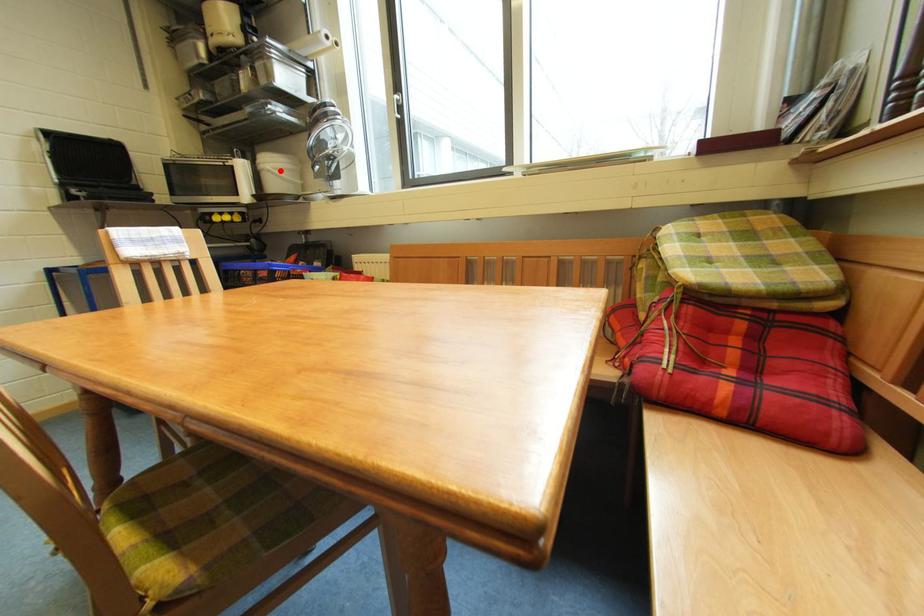
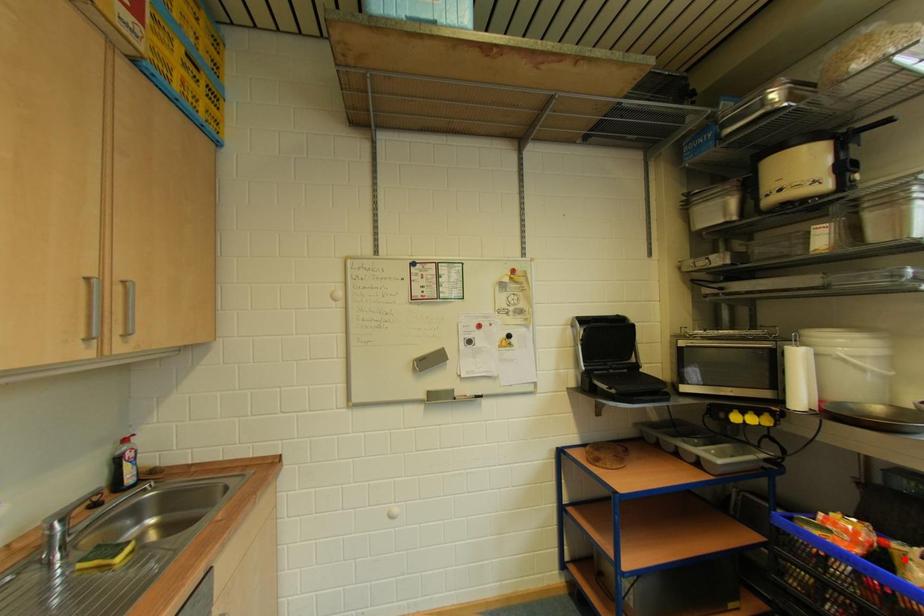
I am providing you with two images of the same scene from different viewpoints. A red point is marked on the first image and another point is marked on the second image. Is the red point in image1 aligned with the point shown in image2?

No